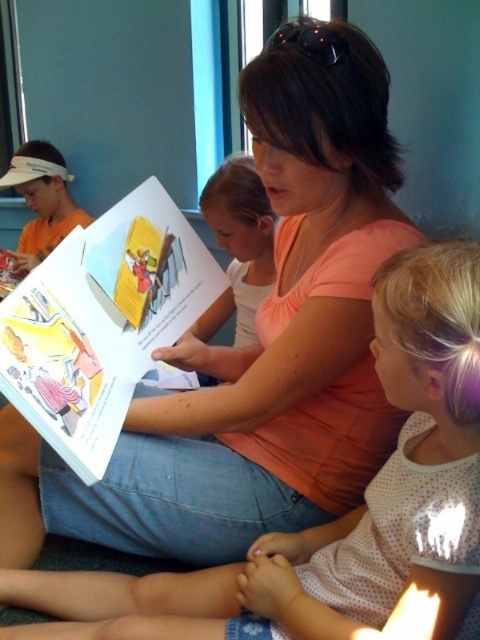
Question: Does polka dot fabric dress at lower right have a larger size compared to matte paper book at center?

Choices:
 (A) yes
 (B) no

Answer: (A)

Question: Which of the following is the farthest from the observer?

Choices:
 (A) (128, 332)
 (B) (474, 422)

Answer: (A)

Question: Is polka dot fabric dress at lower right to the right of matte paper book at center from the viewer's perspective?

Choices:
 (A) yes
 (B) no

Answer: (A)

Question: Does polka dot fabric dress at lower right have a larger size compared to matte paper book at center?

Choices:
 (A) no
 (B) yes

Answer: (B)